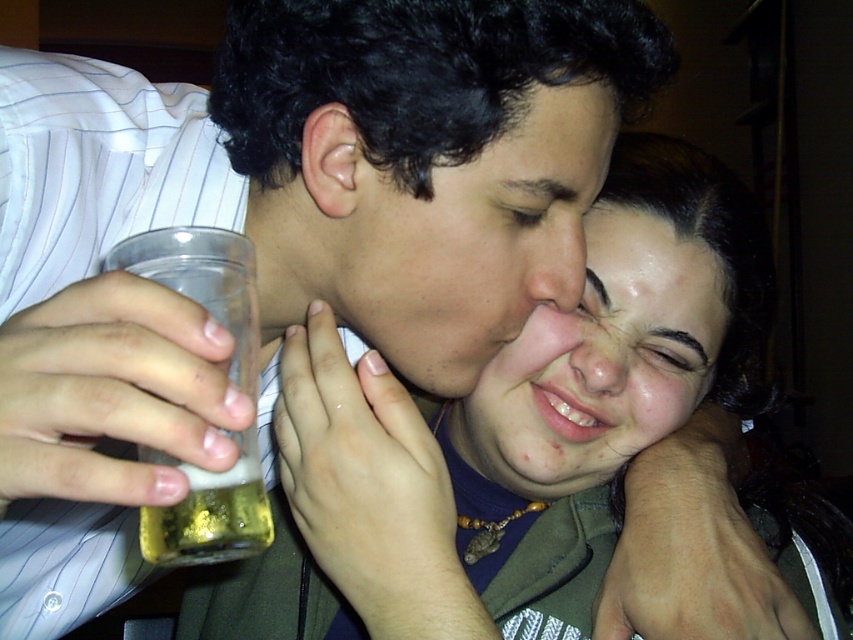
You are a bartender who needs to place the clear plastic cup at lower left on a shelf that is 12 inches wide. Can the cup fit on the shelf?

The clear plastic cup at lower left is 12.67 inches wide, so it cannot fit on the 12 inch shelf.

You are a photographer trying to capture a candid shot of the two people in the scene. You want to ensure that both the oily skin face at center and the translucent plastic cup at lower left are in focus. Given that your camera has a depth of field that can sharply focus on objects within 10 inches of each other, will both subjects be in focus?

The oily skin face at center and the translucent plastic cup at lower left are 9.90 inches apart from each other, which is within the 10 inch depth of field range. Therefore, both subjects will be in focus.